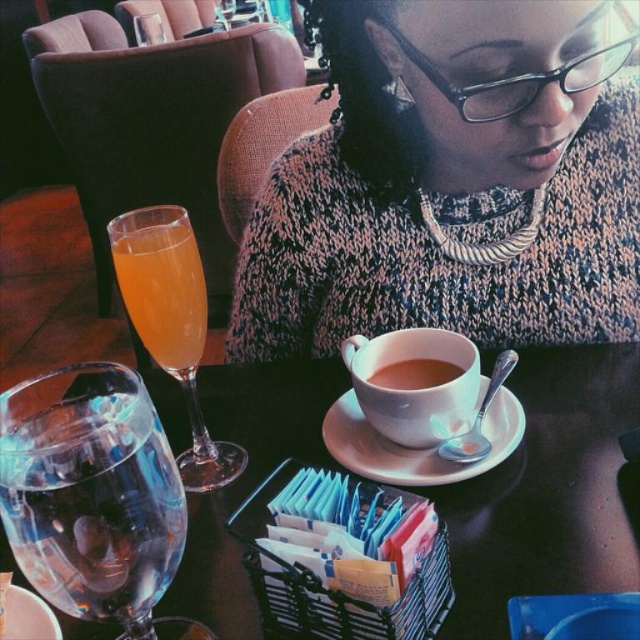
In the scene shown: You are a barista preparing a drink for a customer who ordered a hot chocolate. You need to place the drink on the table where the transparent glass at lower left and brown matte cup at center are already present. Which object should you place the new drink near to ensure it doesn not spill?

The transparent glass at lower left is below the brown matte cup at center, so placing the new drink near the brown matte cup at center would be safer to avoid spilling since it is higher up.

You are a server in a restaurant and need to place a new drink on the table. The drink is in a tall glass that requires a stable surface. Considering the items on the translucent glass table at center and the matte ceramic cup at center, which item should you avoid placing the drink near to ensure stability?

You should avoid placing the drink near the translucent glass table at center because it is closer to the viewer, making it less stable compared to the matte ceramic cup at center which is further back and provides a more secure spot.